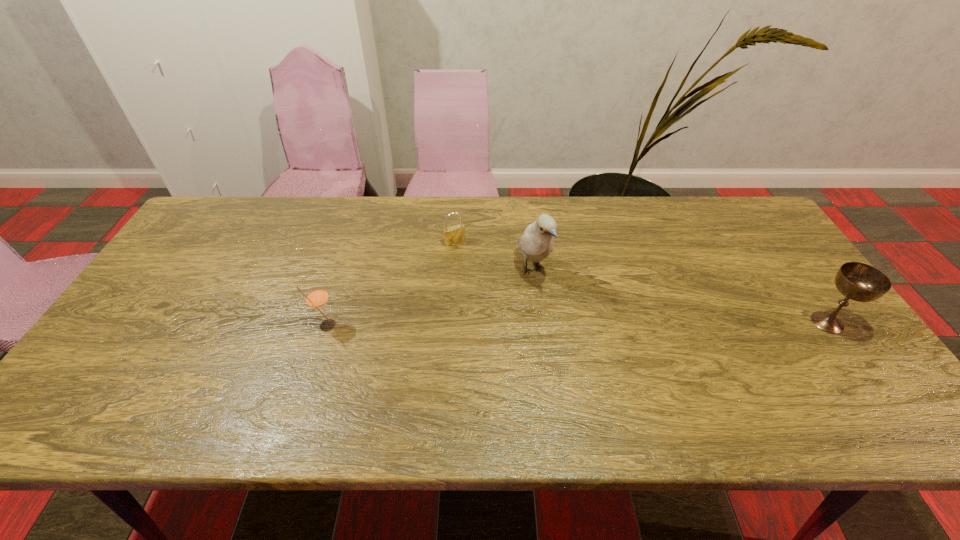
This screenshot has width=960, height=540. Find the location of `the leftmost object`. the leftmost object is located at coordinates (317, 298).

Identify the location of chalice. The height and width of the screenshot is (540, 960). (860, 282).

At what (x,y) coordinates should I click in order to perform the action: click on padlock. Please return your answer as a coordinate pair (x, y). Looking at the image, I should click on (454, 234).

Locate an element on the screen. The height and width of the screenshot is (540, 960). the third object from right to left is located at coordinates (454, 234).

Find the location of `the tallest object`. the tallest object is located at coordinates (537, 242).

Locate an element on the screen. The width and height of the screenshot is (960, 540). the second object from right to left is located at coordinates (537, 242).

You are a GUI agent. You are given a task and a screenshot of the screen. Output one action in this format:
    pyautogui.click(x=<x>, y=<y>)
    Task: Click on the blank space located on the back of the leftmost object
    
    Given the screenshot: What is the action you would take?
    pyautogui.click(x=342, y=279)

You are a GUI agent. You are given a task and a screenshot of the screen. Output one action in this format:
    pyautogui.click(x=<x>, y=<y>)
    Task: Click on the vacant space situated 0.330m on the back of the chalice
    The height and width of the screenshot is (540, 960).
    Given the screenshot: What is the action you would take?
    pyautogui.click(x=761, y=230)

Where is `vacant area situated 0.220m on the front-facing side of the second object from left to right`? Image resolution: width=960 pixels, height=540 pixels. vacant area situated 0.220m on the front-facing side of the second object from left to right is located at coordinates (492, 293).

Where is `free space located on the front-facing side of the second object from left to right`? The image size is (960, 540). free space located on the front-facing side of the second object from left to right is located at coordinates (492, 293).